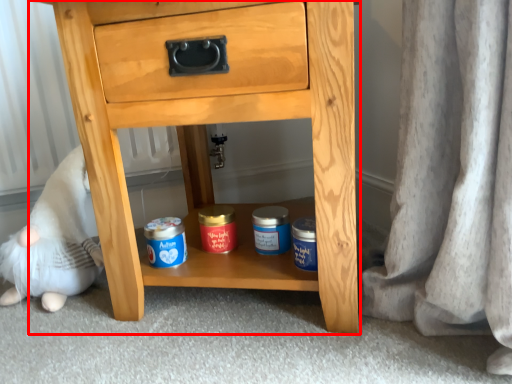
Question: Observing the image, what is the correct spatial positioning of chest of drawers (annotated by the red box) in reference to toy?

Choices:
 (A) left
 (B) right

Answer: (B)